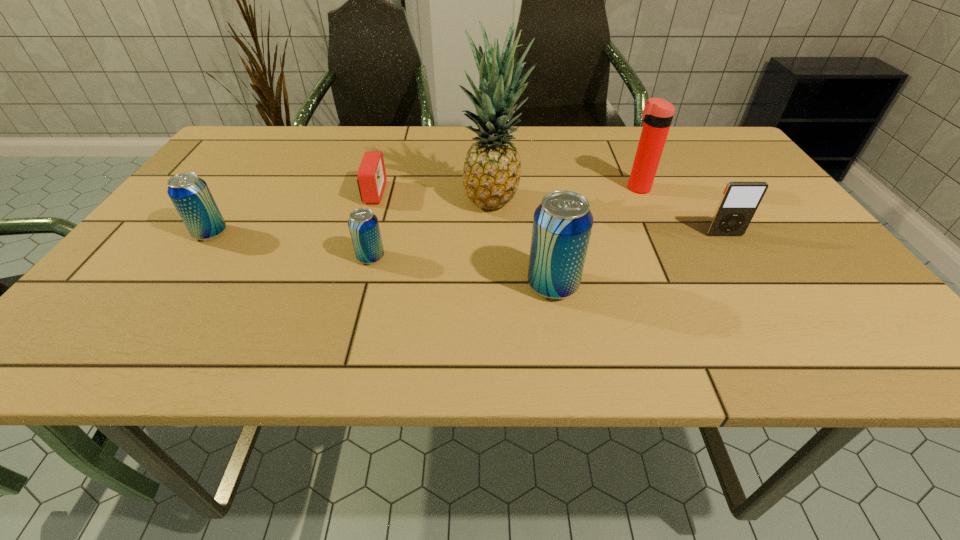
The image size is (960, 540). Identify the location of free space at the far edge of the desktop. (420, 159).

The width and height of the screenshot is (960, 540). Identify the location of vacant space at the near edge. (735, 305).

At what (x,y) coordinates should I click in order to perform the action: click on free space at the left edge of the desktop. Please return your answer as a coordinate pair (x, y). This screenshot has height=540, width=960. Looking at the image, I should click on (163, 224).

Identify the location of vacant area at the far left corner of the desktop. [x=230, y=140].

In the image, there is a desktop. Where is `vacant space at the near left corner`? The width and height of the screenshot is (960, 540). vacant space at the near left corner is located at coordinates (108, 304).

You are a GUI agent. You are given a task and a screenshot of the screen. Output one action in this format:
    pyautogui.click(x=<x>, y=<y>)
    Task: Click on the vacant space at the far right corner of the desktop
    This screenshot has width=960, height=540.
    Given the screenshot: What is the action you would take?
    pyautogui.click(x=691, y=126)

The height and width of the screenshot is (540, 960). In order to click on vacant space at the near right corner in this screenshot , I will do `click(790, 288)`.

Locate an element on the screen. The width and height of the screenshot is (960, 540). free space between the shortest beer can and the tallest object is located at coordinates (432, 230).

At what (x,y) coordinates should I click in order to perform the action: click on vacant area between the iPod and the leftmost beer can. Please return your answer as a coordinate pair (x, y). This screenshot has height=540, width=960. Looking at the image, I should click on 468,234.

The height and width of the screenshot is (540, 960). Find the location of `empty space that is in between the shortest beer can and the fifth shortest object`. empty space that is in between the shortest beer can and the fifth shortest object is located at coordinates [x=462, y=271].